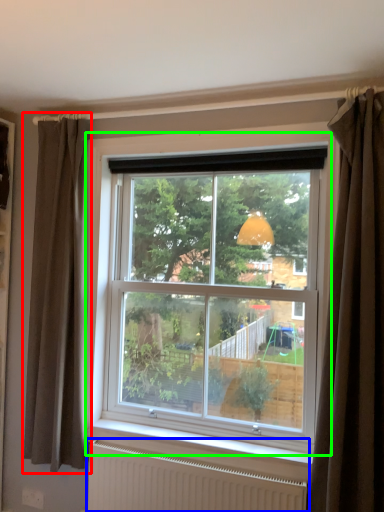
Question: Based on their relative distances, which object is farther from curtain (highlighted by a red box)? Choose from radiator (highlighted by a blue box) and window (highlighted by a green box).

Choices:
 (A) radiator
 (B) window

Answer: (A)